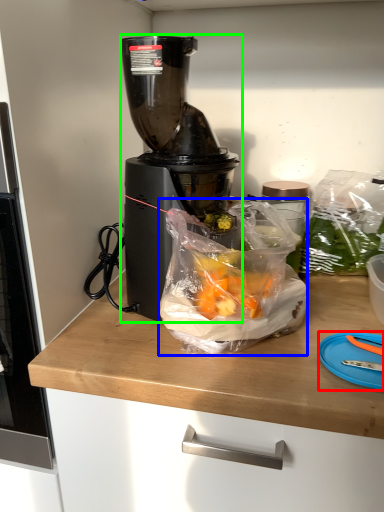
Question: Estimate the real-world distances between objects in this image. Which object is farther from cutting board (highlighted by a red box), waste (highlighted by a blue box) or blender (highlighted by a green box)?

Choices:
 (A) waste
 (B) blender

Answer: (B)